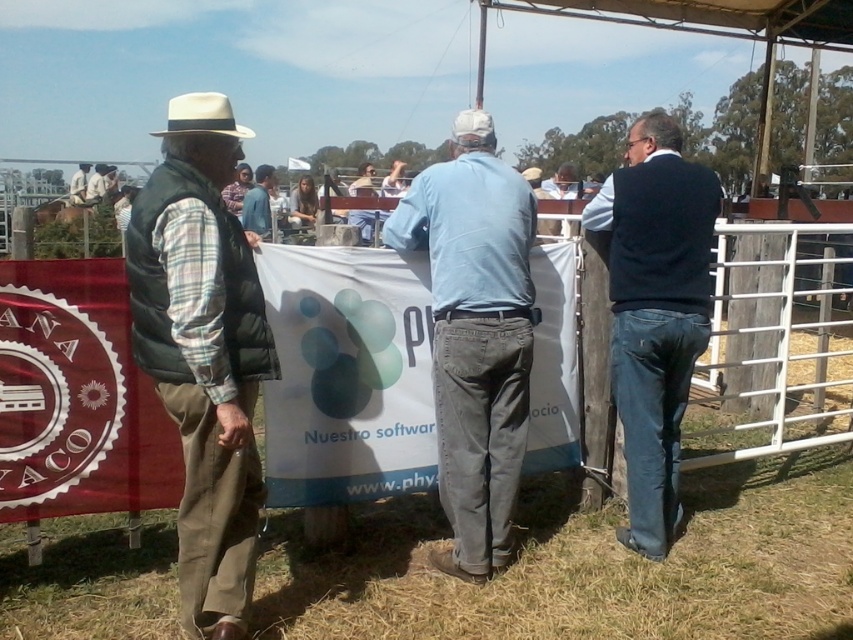
You are a photographer at the fair trying to capture a clear shot of the white felt cowboy hat at upper left and the light brown leather jacket at left. Since you want to ensure both are visible in your photo, which object should you focus on first to account for their size differences?

The white felt cowboy hat at upper left is taller than the light brown leather jacket at left, so you should focus on the white felt cowboy hat at upper left first to ensure its full height is captured before adjusting the frame for the jacket.

You are a photographer at the fair and want to capture both the light blue denim jeans at center and the blue denim shirt at center in a single photo. Which object should you focus on to ensure both are in frame without needing to zoom in or out?

You should focus on the light blue denim jeans at center because it has a larger size compared to the blue denim shirt at center, making it easier to include both in the frame without adjusting the zoom.